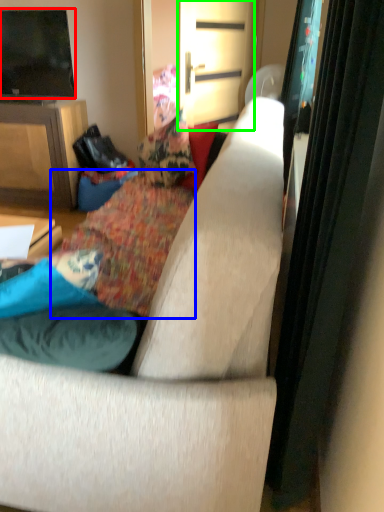
Question: Which is nearer to the television (highlighted by a red box)? bedding (highlighted by a blue box) or screen door (highlighted by a green box).

Choices:
 (A) bedding
 (B) screen door

Answer: (B)